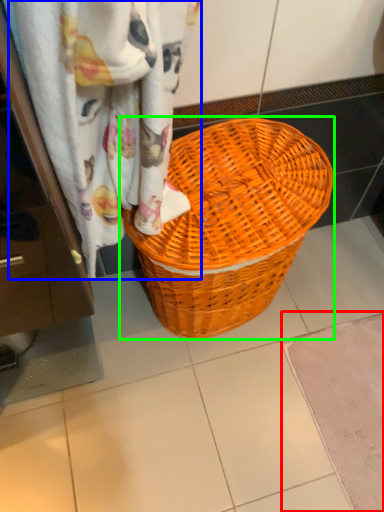
Question: Based on their relative distances, which object is farther from bath mat (highlighted by a red box)? Choose from curtain (highlighted by a blue box) and picnic basket (highlighted by a green box).

Choices:
 (A) curtain
 (B) picnic basket

Answer: (A)